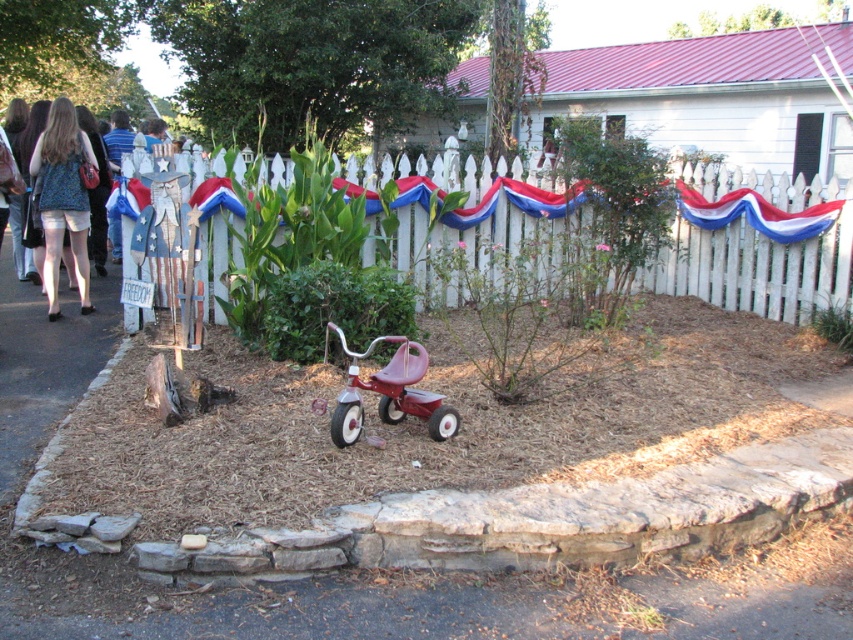
You are standing in front of the white picket fence with the red tricycle. There are two points marked on the ground in front of the fence. Which point is closer to you, point (236, 216) or point (358, 356)?

Point (236, 216) is closer to you because it is further to the camera than point (358, 356).

You are a child who wants to ride the metallic red tricycle at center. You are currently standing next to the white picket fence at center. To get to the tricycle, should you move to your left or right?

The white picket fence at center is to the right of the metallic red tricycle at center. So, to reach the tricycle, you should move to your left.